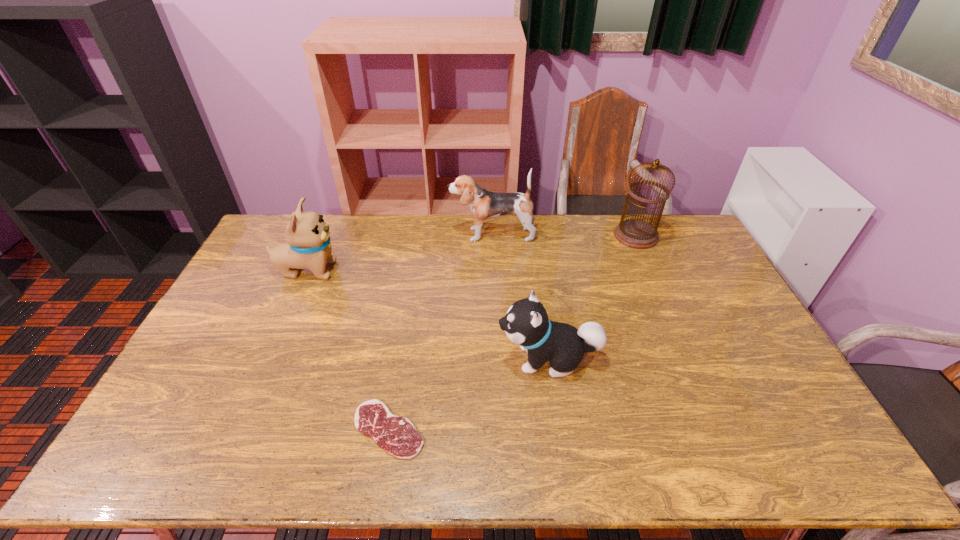
Image resolution: width=960 pixels, height=540 pixels. I want to click on puppy that is the third closest one to the birdcage, so click(x=308, y=245).

You are a GUI agent. You are given a task and a screenshot of the screen. Output one action in this format:
    pyautogui.click(x=<x>, y=<y>)
    Task: Click on the puppy that is the second nearest to the second nearest puppy
    The height and width of the screenshot is (540, 960).
    Given the screenshot: What is the action you would take?
    pyautogui.click(x=526, y=324)

Where is `free spot that satisfies the following two spatial constraints: 1. on the front-facing side of the birdcage; 2. on the face of the leftmost puppy`? The image size is (960, 540). free spot that satisfies the following two spatial constraints: 1. on the front-facing side of the birdcage; 2. on the face of the leftmost puppy is located at coordinates (651, 270).

This screenshot has width=960, height=540. What are the coordinates of `free point that satisfies the following two spatial constraints: 1. on the face of the second farthest puppy; 2. on the back side of the fourth object from right to left` in the screenshot? It's located at (238, 429).

I want to click on vacant region that satisfies the following two spatial constraints: 1. at the face of the fourth tallest object; 2. on the front side of the nearest object, so click(x=559, y=429).

Where is `vacant position in the image that satisfies the following two spatial constraints: 1. on the front-facing side of the birdcage; 2. at the face of the nearest puppy`? The height and width of the screenshot is (540, 960). vacant position in the image that satisfies the following two spatial constraints: 1. on the front-facing side of the birdcage; 2. at the face of the nearest puppy is located at coordinates (689, 359).